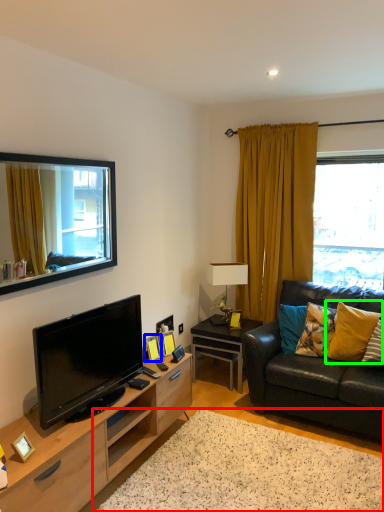
Question: Considering the real-world distances, which object is closest to plain (highlighted by a red box)? picture frame (highlighted by a blue box) or pillow (highlighted by a green box).

Choices:
 (A) picture frame
 (B) pillow

Answer: (A)